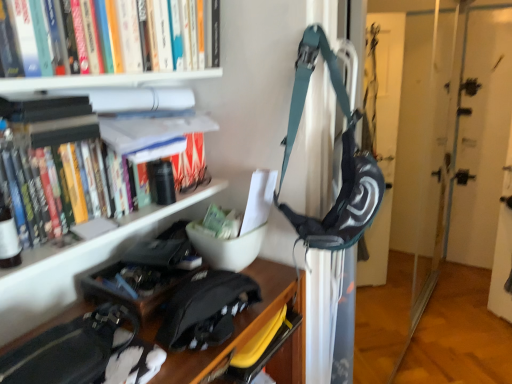
Question: Would you consider black matte messenger bag at lower center to be distant from white matte bookshelf at upper left?

Choices:
 (A) no
 (B) yes

Answer: (A)

Question: From the image's perspective, would you say black matte messenger bag at lower center is positioned over white matte bookshelf at upper left?

Choices:
 (A) yes
 (B) no

Answer: (B)

Question: Does black matte messenger bag at lower center have a larger size compared to white matte bookshelf at upper left?

Choices:
 (A) yes
 (B) no

Answer: (B)

Question: From a real-world perspective, is black matte messenger bag at lower center physically above white matte bookshelf at upper left?

Choices:
 (A) yes
 (B) no

Answer: (B)

Question: Could you tell me if black matte messenger bag at lower center is facing white matte bookshelf at upper left?

Choices:
 (A) no
 (B) yes

Answer: (A)

Question: Is white matte bookshelf at upper left in front of or behind black matte messenger bag at lower center in the image?

Choices:
 (A) front
 (B) behind

Answer: (A)

Question: Would you say white matte bookshelf at upper left is inside or outside black matte messenger bag at lower center?

Choices:
 (A) inside
 (B) outside

Answer: (B)

Question: Is white matte bookshelf at upper left bigger or smaller than black matte messenger bag at lower center?

Choices:
 (A) big
 (B) small

Answer: (A)

Question: Is point (113, 84) positioned closer to the camera than point (227, 279)?

Choices:
 (A) closer
 (B) farther

Answer: (A)

Question: In the image, is black matte messenger bag at lower center positioned in front of or behind white matte bookshelf at upper left?

Choices:
 (A) front
 (B) behind

Answer: (B)

Question: Visually, is black matte messenger bag at lower center positioned to the left or to the right of white matte bookshelf at upper left?

Choices:
 (A) right
 (B) left

Answer: (A)

Question: Considering the positions of black matte messenger bag at lower center and white matte bookshelf at upper left in the image, is black matte messenger bag at lower center bigger or smaller than white matte bookshelf at upper left?

Choices:
 (A) small
 (B) big

Answer: (A)

Question: Looking at their shapes, would you say black matte messenger bag at lower center is wider or thinner than white matte bookshelf at upper left?

Choices:
 (A) wide
 (B) thin

Answer: (B)

Question: Is hardcover books at upper left spatially inside white matte bookshelf at upper left, or outside of it?

Choices:
 (A) outside
 (B) inside

Answer: (B)

Question: Is hardcover books at upper left bigger or smaller than white matte bookshelf at upper left?

Choices:
 (A) small
 (B) big

Answer: (A)